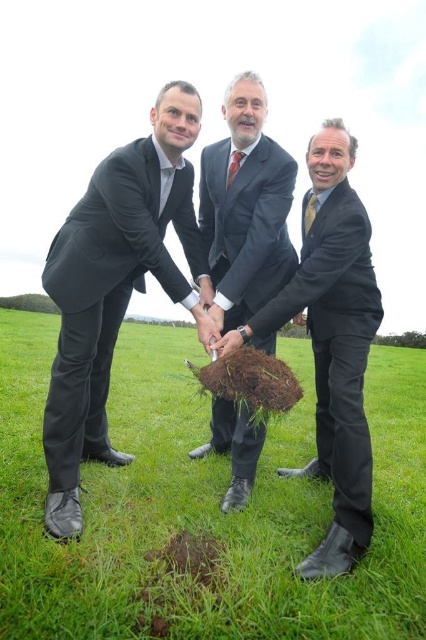
You are a photographer capturing the scene of three men planting a tree. You need to ensure that the black matte suit at left is visible above the green grass at center in your photo. Based on their positions, is this possible?

The green grass at center is positioned under the black matte suit at left, so yes, the black matte suit at left will naturally appear above the green grass at center in the photo.

You are a photographer at a formal event. You need to arrange the black matte suit at left and the matte black suit at center in a group photo so that the shorter one stands in front to avoid blocking the view. Which person should be placed in front?

The matte black suit at center should be placed in front because it is shorter than the black matte suit at left.

You are a photographer at the event and want to capture both the black matte suit at left and the green leafy tree at center in a single frame. Which object should you focus on first to ensure both are in the frame?

The black matte suit at left has a lesser width compared to green leafy tree at center, so you should focus on the wider green leafy tree at center first to ensure both fit in the frame.